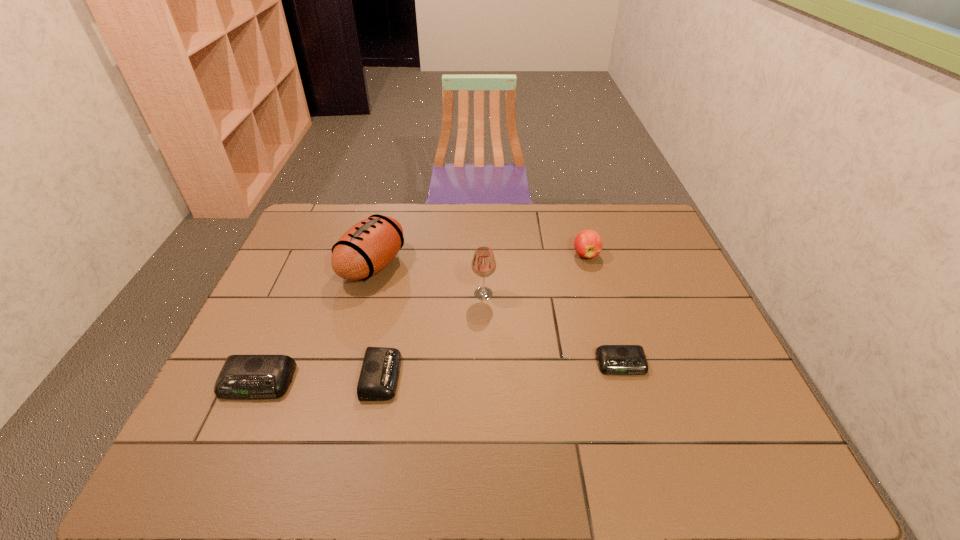
At what (x,y) coordinates should I click in order to perform the action: click on the leftmost object. Please return your answer as a coordinate pair (x, y). Image resolution: width=960 pixels, height=540 pixels. Looking at the image, I should click on (242, 376).

Where is `the second alarm clock from right to left`? The image size is (960, 540). the second alarm clock from right to left is located at coordinates (378, 380).

You are a GUI agent. You are given a task and a screenshot of the screen. Output one action in this format:
    pyautogui.click(x=<x>, y=<y>)
    Task: Click on the second shortest alarm clock
    The image size is (960, 540).
    Given the screenshot: What is the action you would take?
    (378, 380)

Identify the location of the shortest object. The height and width of the screenshot is (540, 960). (612, 359).

Identify the location of the shortest alarm clock. (612, 359).

The height and width of the screenshot is (540, 960). What are the coordinates of `football (American)` in the screenshot? It's located at (366, 248).

The image size is (960, 540). What are the coordinates of `apple` in the screenshot? It's located at (588, 244).

Where is `wineglass`? wineglass is located at coordinates (483, 264).

The height and width of the screenshot is (540, 960). I want to click on vacant region located on the display of the leftmost alarm clock, so click(x=239, y=424).

Find the location of a particular element. The width and height of the screenshot is (960, 540). vacant point located 0.360m on the display of the second shortest alarm clock is located at coordinates (544, 376).